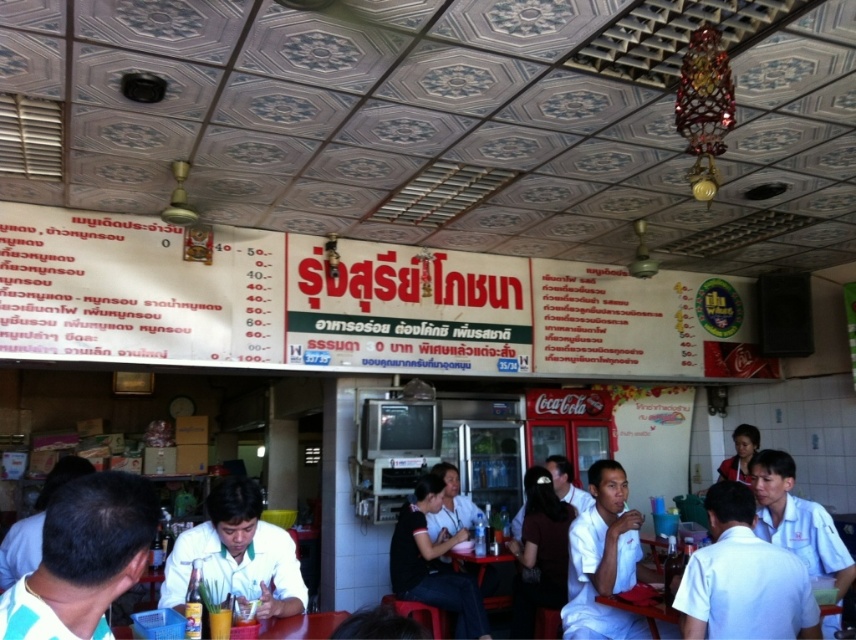
Is white matte shirt at lower left shorter than white uniform shirt at center?

Correct, white matte shirt at lower left is not as tall as white uniform shirt at center.

Who is more forward, (x=52, y=588) or (x=277, y=532)?

Positioned in front is point (x=52, y=588).

Image resolution: width=856 pixels, height=640 pixels. I want to click on white matte shirt at lower left, so click(82, 557).

Is white matte shirt at center to the right of white uniform shirt at right from the viewer's perspective?

No, white matte shirt at center is not to the right of white uniform shirt at right.

Which of these two, white matte shirt at center or white uniform shirt at right, stands taller?

Standing taller between the two is white matte shirt at center.

Between point (562, 634) and point (783, 486), which one is positioned behind?

The point (783, 486) is behind.

The width and height of the screenshot is (856, 640). I want to click on white matte shirt at center, so click(604, 561).

Who is more forward, (587, 508) or (735, 445)?

Point (587, 508)

Based on the photo, does white matte shirt at center have a greater width compared to white shirt at upper right?

Correct, the width of white matte shirt at center exceeds that of white shirt at upper right.

Is point (581, 570) positioned after point (741, 468)?

No, (581, 570) is closer to viewer.

Identify the location of white matte shirt at center. (604, 561).